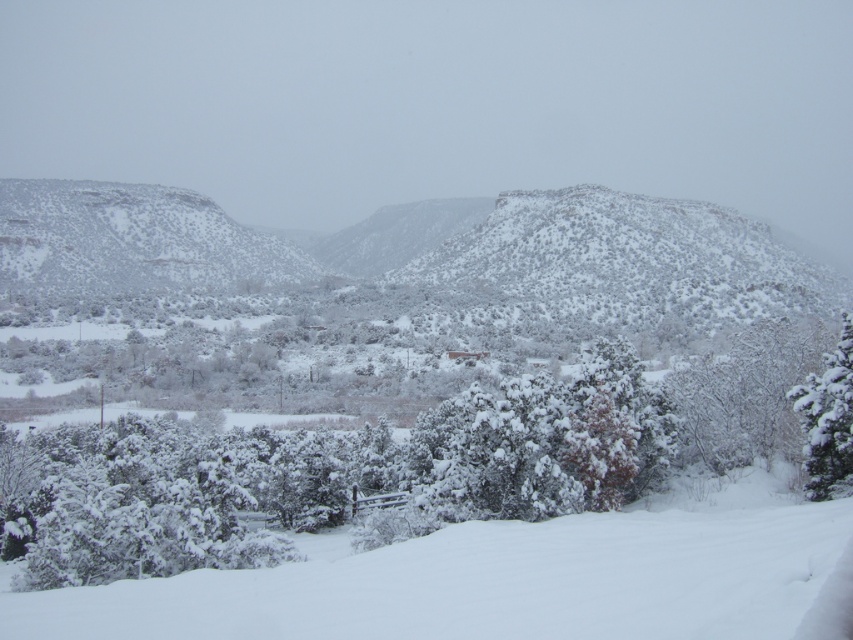
Question: Which point is farther to the camera?

Choices:
 (A) (840, 410)
 (B) (654, 547)
 (C) (9, 500)
 (D) (799, 268)

Answer: (D)

Question: Does snow-covered rock at left have a smaller size compared to white snow ski slope at lower center?

Choices:
 (A) no
 (B) yes

Answer: (A)

Question: Does snow-covered rock at left appear over white fluffy snow at right?

Choices:
 (A) yes
 (B) no

Answer: (A)

Question: Estimate the real-world distances between objects in this image. Which object is farther from the white fluffy snow at right?

Choices:
 (A) white snow ski slope at lower center
 (B) snow-covered rock at left

Answer: (B)

Question: Which of the following is the closest to the observer?

Choices:
 (A) white snow ski slope at lower center
 (B) white fluffy snow at right

Answer: (A)

Question: From the image, what is the correct spatial relationship of white fluffy snow at center in relation to white fluffy snow at right?

Choices:
 (A) below
 (B) above

Answer: (A)